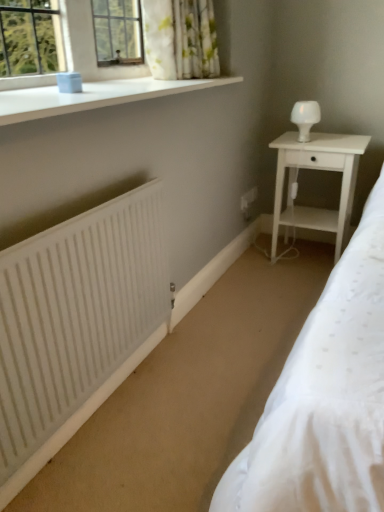
This screenshot has width=384, height=512. Identify the location of free space behind white glossy table lamp at upper right. (309, 133).